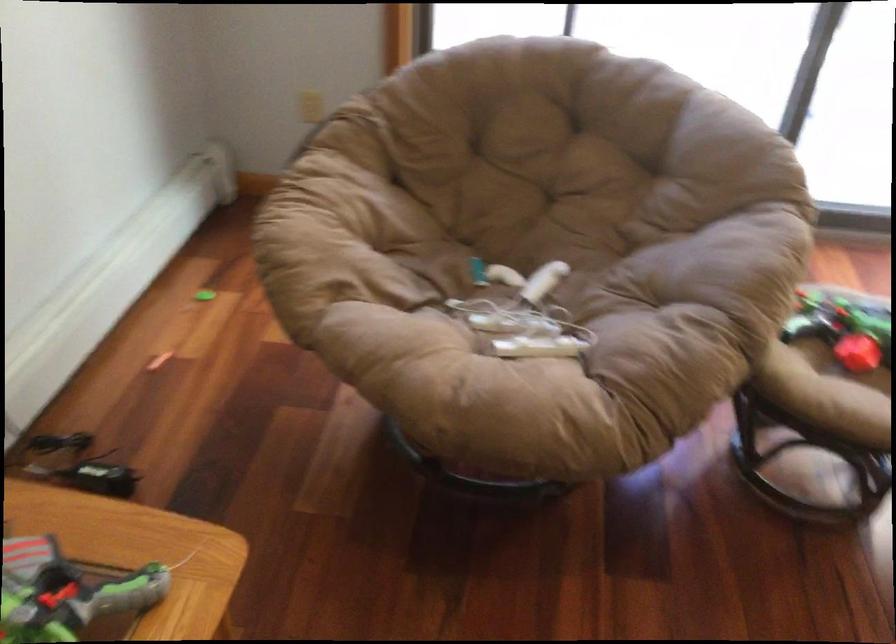
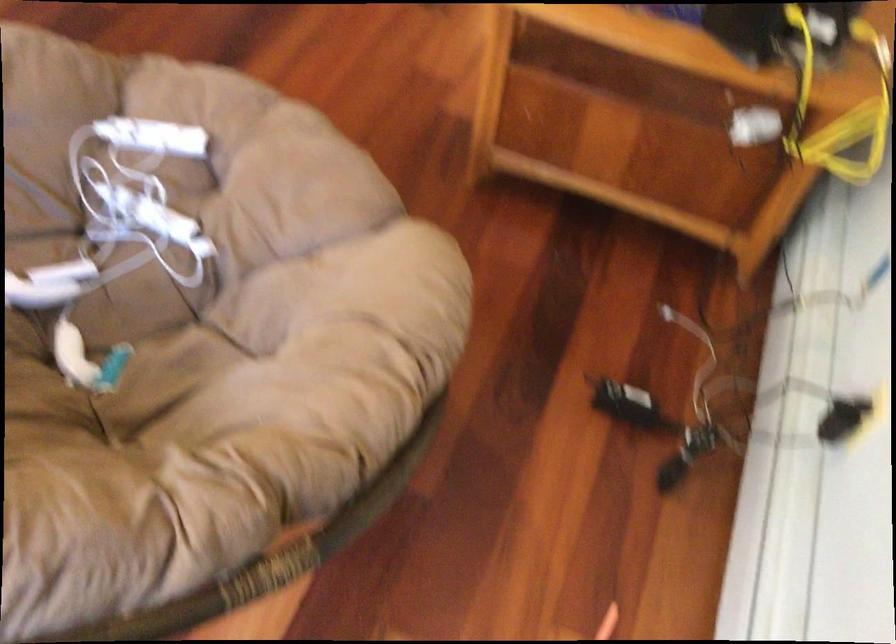
In the second image, find the point that corresponds to point 530,314 in the first image.

(113, 236)